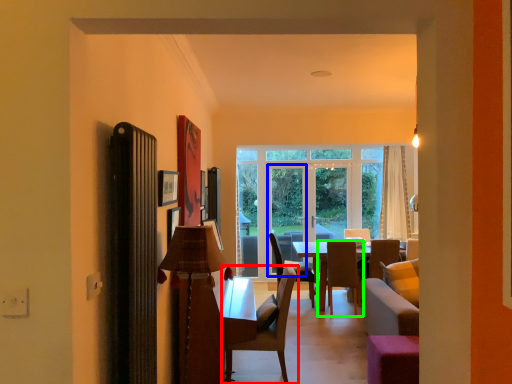
Question: Which object is the closest to the chair (highlighted by a red box)? Choose among these: screen door (highlighted by a blue box) or chair (highlighted by a green box).

Choices:
 (A) screen door
 (B) chair

Answer: (B)